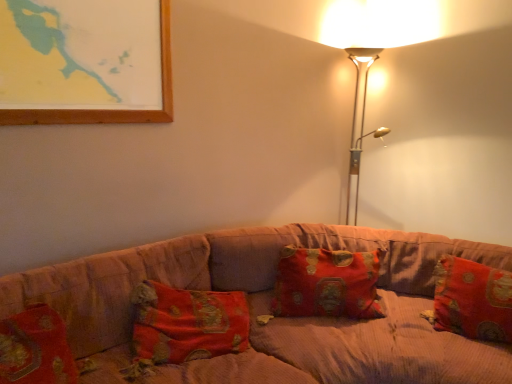
Question: Is metallic gold floor lamp at upper right with red brocade pillow at right, the 2th pillow positioned from the left?

Choices:
 (A) yes
 (B) no

Answer: (B)

Question: Can you confirm if metallic gold floor lamp at upper right is taller than red brocade pillow at right, which ranks as the 1th pillow in right-to-left order?

Choices:
 (A) yes
 (B) no

Answer: (A)

Question: Is metallic gold floor lamp at upper right closer to the viewer compared to red brocade pillow at right, the 2th pillow positioned from the left?

Choices:
 (A) no
 (B) yes

Answer: (A)

Question: Does metallic gold floor lamp at upper right appear on the right side of red brocade pillow at right, the 2th pillow positioned from the left?

Choices:
 (A) yes
 (B) no

Answer: (B)

Question: From the image's perspective, does metallic gold floor lamp at upper right appear higher than red brocade pillow at right, the 2th pillow positioned from the left?

Choices:
 (A) no
 (B) yes

Answer: (B)

Question: Based on their positions, is metallic gold floor lamp at upper right located to the left or right of red brocade pillow at center, acting as the second pillow starting from the right?

Choices:
 (A) left
 (B) right

Answer: (B)

Question: Is point (355, 221) positioned closer to the camera than point (336, 312)?

Choices:
 (A) farther
 (B) closer

Answer: (A)

Question: From the image's perspective, is metallic gold floor lamp at upper right above or below red brocade pillow at center, acting as the second pillow starting from the right?

Choices:
 (A) above
 (B) below

Answer: (A)

Question: Looking at the image, does metallic gold floor lamp at upper right seem bigger or smaller compared to red brocade pillow at center, acting as the second pillow starting from the right?

Choices:
 (A) small
 (B) big

Answer: (B)

Question: From the image's perspective, is red brocade pillow at center, acting as the second pillow starting from the right, positioned above or below metallic gold floor lamp at upper right?

Choices:
 (A) below
 (B) above

Answer: (A)

Question: In the image, is red brocade pillow at center, acting as the second pillow starting from the right, on the left side or the right side of metallic gold floor lamp at upper right?

Choices:
 (A) left
 (B) right

Answer: (A)

Question: Do you think red brocade pillow at center, which appears as the 1th pillow when viewed from the left, is within metallic gold floor lamp at upper right, or outside of it?

Choices:
 (A) outside
 (B) inside

Answer: (A)

Question: Is red brocade pillow at center, acting as the second pillow starting from the right, in front of or behind metallic gold floor lamp at upper right in the image?

Choices:
 (A) front
 (B) behind

Answer: (A)

Question: From the image's perspective, is corduroy fabric couch at center located above or below metallic gold floor lamp at upper right?

Choices:
 (A) above
 (B) below

Answer: (B)

Question: Considering their positions, is corduroy fabric couch at center located in front of or behind metallic gold floor lamp at upper right?

Choices:
 (A) behind
 (B) front

Answer: (B)